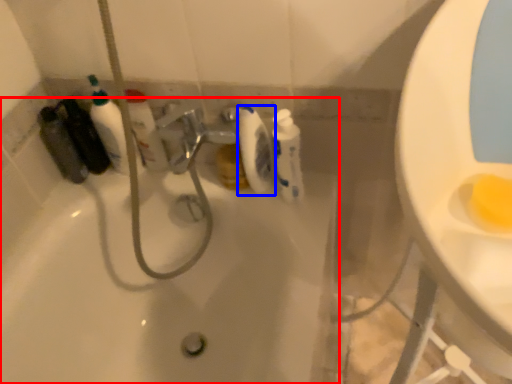
Question: Among these objects, which one is farthest to the camera, bathtub (highlighted by a red box) or toilet paper (highlighted by a blue box)?

Choices:
 (A) bathtub
 (B) toilet paper

Answer: (B)